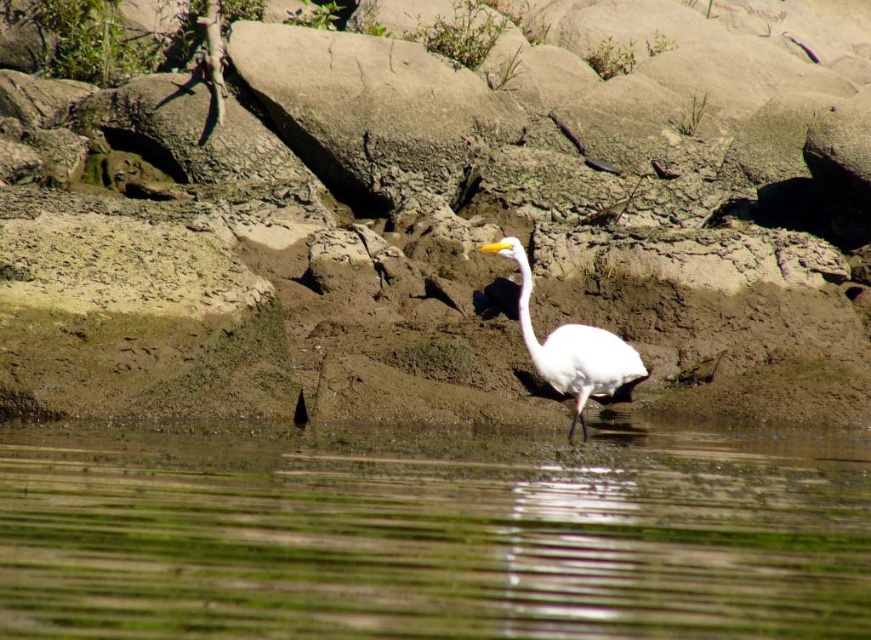
Question: Which of the following is the closest to the observer?

Choices:
 (A) white matte bird at center
 (B) rough textured rock at center
 (C) green algae water at lower center

Answer: (C)

Question: Is rough textured rock at center to the right of white matte bird at center from the viewer's perspective?

Choices:
 (A) yes
 (B) no

Answer: (B)

Question: Is rough textured rock at center smaller than green algae water at lower center?

Choices:
 (A) yes
 (B) no

Answer: (B)

Question: Estimate the real-world distances between objects in this image. Which object is closer to the white matte bird at center?

Choices:
 (A) green algae water at lower center
 (B) rough textured rock at center

Answer: (A)

Question: Is rough textured rock at center bigger than white matte bird at center?

Choices:
 (A) yes
 (B) no

Answer: (A)

Question: Which point is closer to the camera?

Choices:
 (A) rough textured rock at center
 (B) green algae water at lower center

Answer: (B)